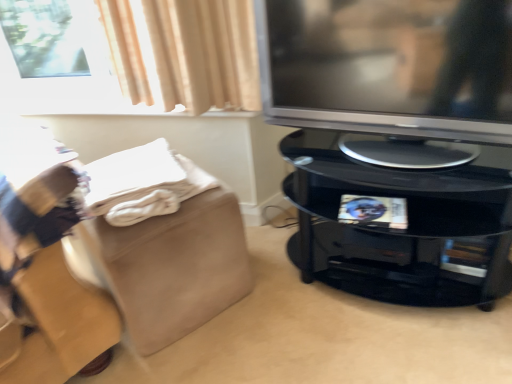
In order to click on vacant space in front of beige suede footrest at lower left in this screenshot , I will do point(196,355).